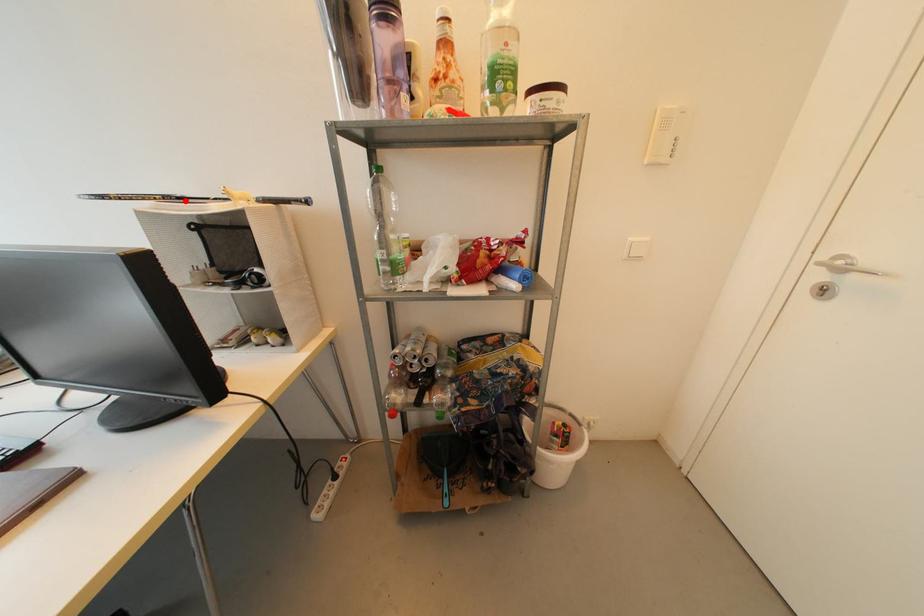
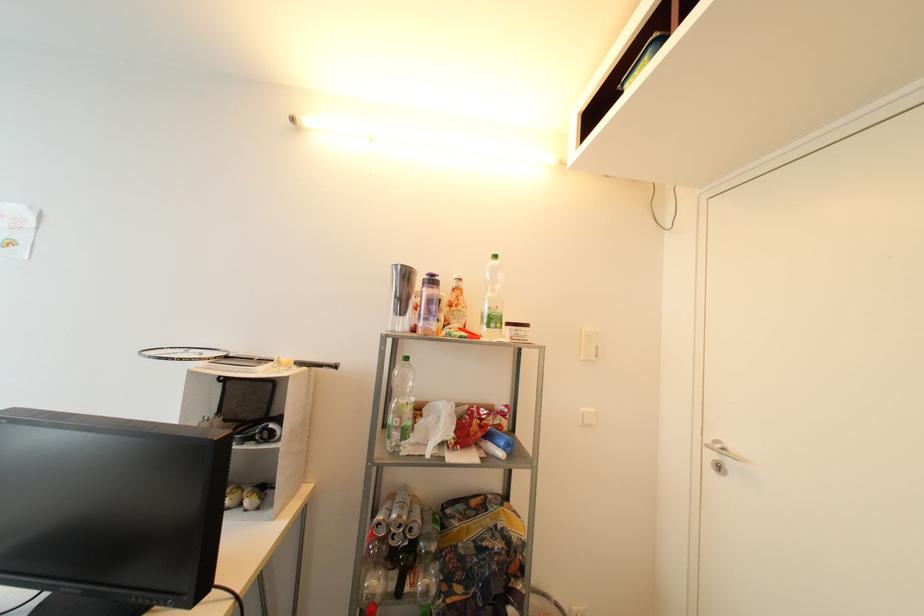
Locate, in the second image, the point that corresponds to the highlighted location in the first image.

(232, 359)